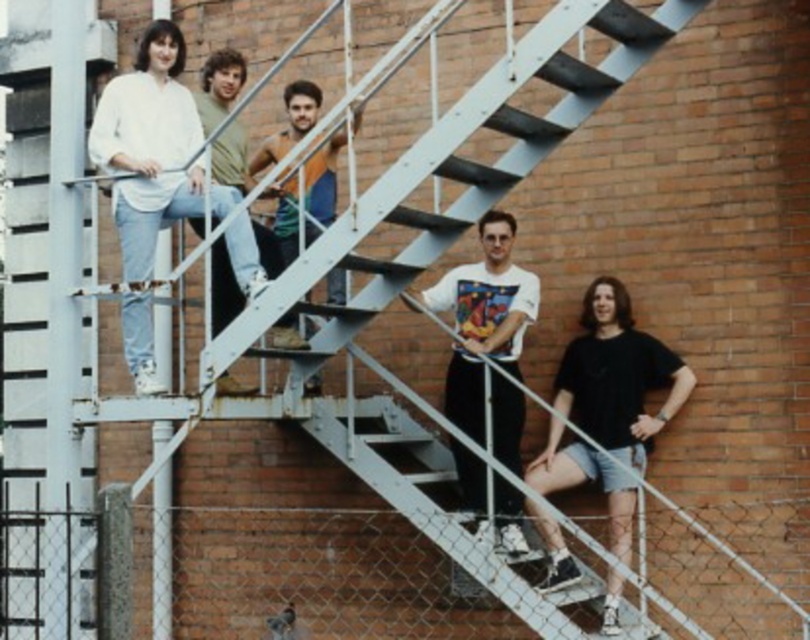
Is point (565, 554) farther from camera compared to point (457, 356)?

No, (565, 554) is closer to viewer.

Who is higher up, black cotton t-shirt at lower right or white printed t-shirt at center?

white printed t-shirt at center is higher up.

Locate an element on the screen. black cotton t-shirt at lower right is located at coordinates (617, 376).

Who is more forward, (143,49) or (544,493)?

Point (143,49) is in front.

Can you confirm if white cotton shirt at upper left is shorter than black cotton t-shirt at lower right?

In fact, white cotton shirt at upper left may be taller than black cotton t-shirt at lower right.

Which is behind, point (117, 205) or point (676, 374)?

Point (676, 374)

Where is `white cotton shirt at upper left`? This screenshot has height=640, width=810. white cotton shirt at upper left is located at coordinates click(x=148, y=147).

Does point (553, 392) come in front of point (246, 148)?

Yes, it is.

Does black cotton t-shirt at lower right have a greater height compared to light brown denim jeans at upper center?

Yes, black cotton t-shirt at lower right is taller than light brown denim jeans at upper center.

Where is `black cotton t-shirt at lower right`? Image resolution: width=810 pixels, height=640 pixels. black cotton t-shirt at lower right is located at coordinates (617, 376).